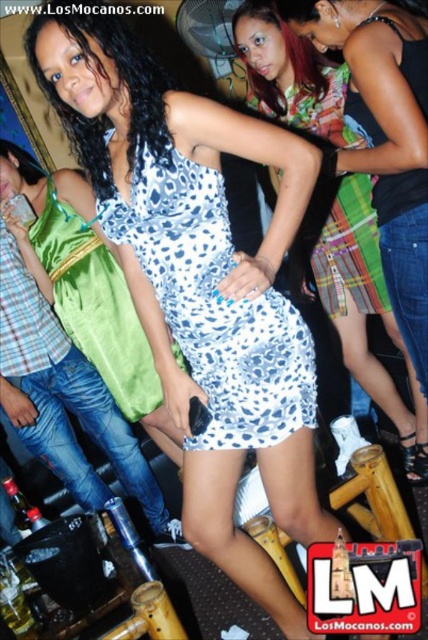
You are at a party and want to take a photo of the white leopard print dress at center. Where should you aim your camera to capture it?

You should aim your camera at point (365,310) to capture the white leopard print dress at center.

You are at the party and want to take a photo of the two points in the image. The first point is at coordinates point [51,186] and the second point is at point [344,225]. Which point will appear closer to the camera in your photo?

Point [51,186] is further to the camera than point [344,225], so the first point will appear closer to the camera in the photo.